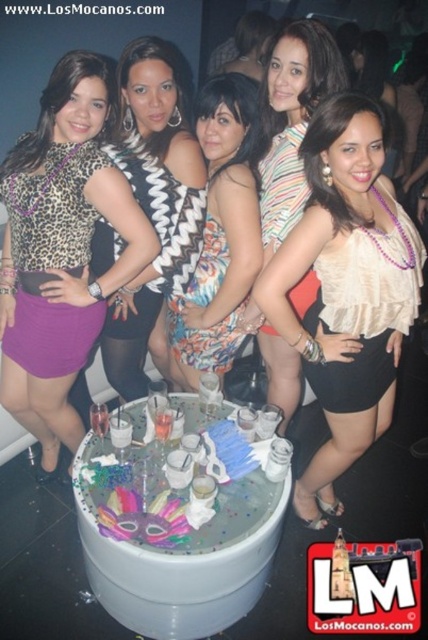
You are standing at the entrance of the nightclub and see two points in the image. The first point is at coordinate point (125, 52) and the second is at point (210, 220). Which point is closer to you?

Point (125, 52) is in front of point (210, 220), so the first point is closer to you.

You are a photographer at the party. You want to capture a closeup shot of the leopard print top at center and the floral dress at center in the same frame. What is the minimum distance you need to maintain between the camera and the subjects to ensure both are in focus?

The minimum distance you need to maintain between the camera and the subjects to ensure both the leopard print top at center and the floral dress at center are in focus is 17.29 inches, as this is the distance between them.